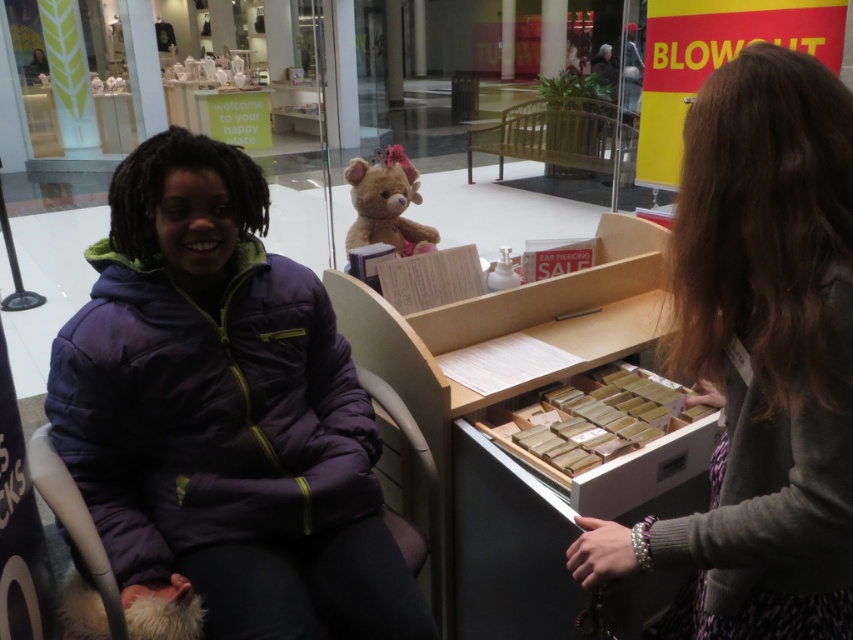
Which is above, purple puffy jacket at center or fluffy brown bear at upper center?

fluffy brown bear at upper center is higher up.

Is purple puffy jacket at center smaller than fluffy brown bear at upper center?

Incorrect, purple puffy jacket at center is not smaller in size than fluffy brown bear at upper center.

Between point (157, 636) and point (415, 195), which one is positioned behind?

Point (415, 195)

Identify the location of purple puffy jacket at center. The width and height of the screenshot is (853, 640). (222, 419).

Can you confirm if purple puffy jacket at center is shorter than gray knit sweater at center?

Yes.

Does purple puffy jacket at center lie behind gray knit sweater at center?

Yes, purple puffy jacket at center is further from the viewer.

Is point (183, 189) less distant than point (691, 636)?

No, it is behind (691, 636).

Locate an element on the screen. Image resolution: width=853 pixels, height=640 pixels. purple puffy jacket at center is located at coordinates (222, 419).

Who is higher up, gray knit sweater at center or fluffy brown bear at upper center?

fluffy brown bear at upper center is above.

Image resolution: width=853 pixels, height=640 pixels. What do you see at coordinates (759, 358) in the screenshot?
I see `gray knit sweater at center` at bounding box center [759, 358].

At what (x,y) coordinates should I click in order to perform the action: click on gray knit sweater at center. Please return your answer as a coordinate pair (x, y). This screenshot has height=640, width=853. Looking at the image, I should click on (759, 358).